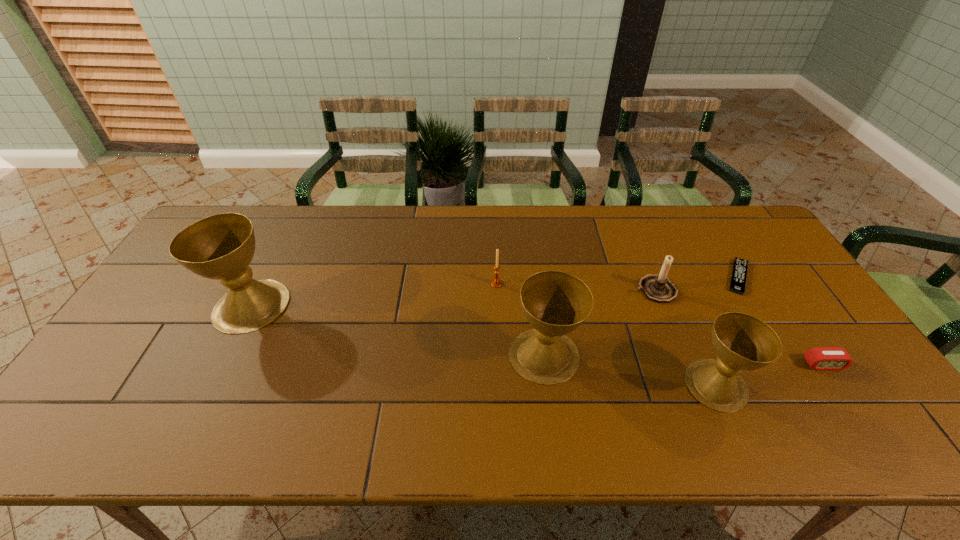
Please point a location where one more chalice can be added evenly. Please provide its 2D coordinates. Your answer should be formatted as a tuple, i.e. [(x, y)], where the tuple contains the x and y coordinates of a point satisfying the conditions above.

[(390, 329)]